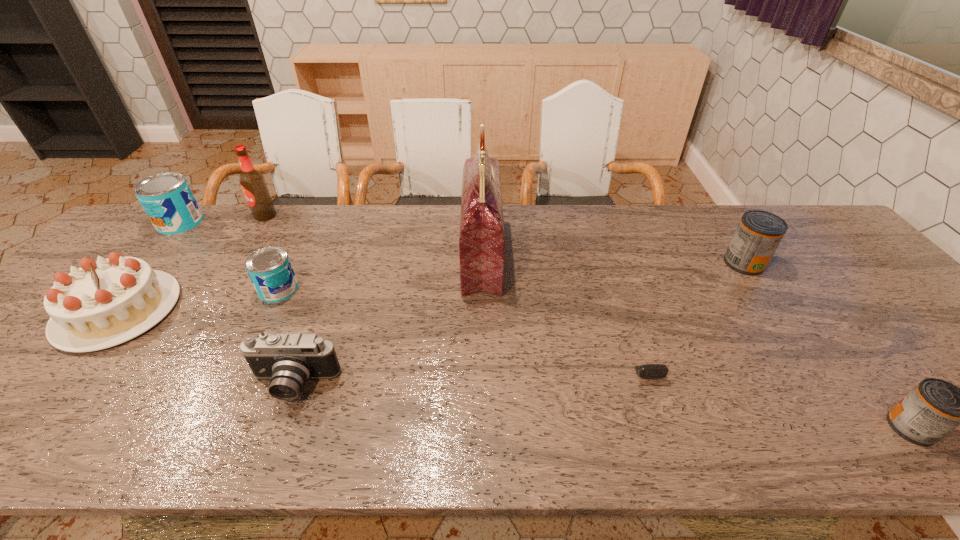
Where is `vacant position located 0.270m on the right of the bigger blue can`? The height and width of the screenshot is (540, 960). vacant position located 0.270m on the right of the bigger blue can is located at coordinates (286, 223).

Find the location of a particular element. Image resolution: width=960 pixels, height=540 pixels. free space located on the front of the second object from right to left is located at coordinates (780, 315).

Locate an element on the screen. This screenshot has width=960, height=540. vacant space situated on the back of the birthday cake is located at coordinates (184, 231).

Image resolution: width=960 pixels, height=540 pixels. Find the location of `free space located 0.350m on the front of the smaller blue can`. free space located 0.350m on the front of the smaller blue can is located at coordinates (211, 427).

The height and width of the screenshot is (540, 960). What are the coordinates of `vacant space located on the back of the nearest can` in the screenshot? It's located at (857, 359).

Image resolution: width=960 pixels, height=540 pixels. What are the coordinates of `vacant space located on the front-facing side of the webcam` in the screenshot? It's located at (659, 420).

Where is `handbag positioned at the far edge`? The height and width of the screenshot is (540, 960). handbag positioned at the far edge is located at coordinates (481, 239).

You are a GUI agent. You are given a task and a screenshot of the screen. Output one action in this format:
    pyautogui.click(x=<x>, y=<y>)
    Task: Click on the beer bottle at the far edge
    This screenshot has height=540, width=960.
    Given the screenshot: What is the action you would take?
    pyautogui.click(x=253, y=183)

At what (x,y) coordinates should I click in order to perform the action: click on can present at the far edge. Please return your answer as a coordinate pair (x, y). Looking at the image, I should click on [167, 199].

Where is `object that is positioned at the near edge`? Image resolution: width=960 pixels, height=540 pixels. object that is positioned at the near edge is located at coordinates (934, 408).